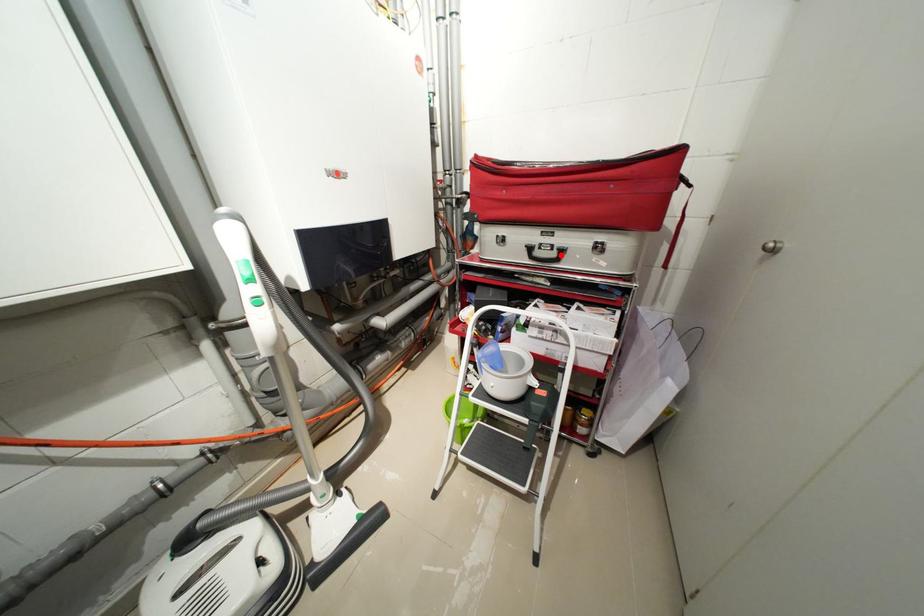
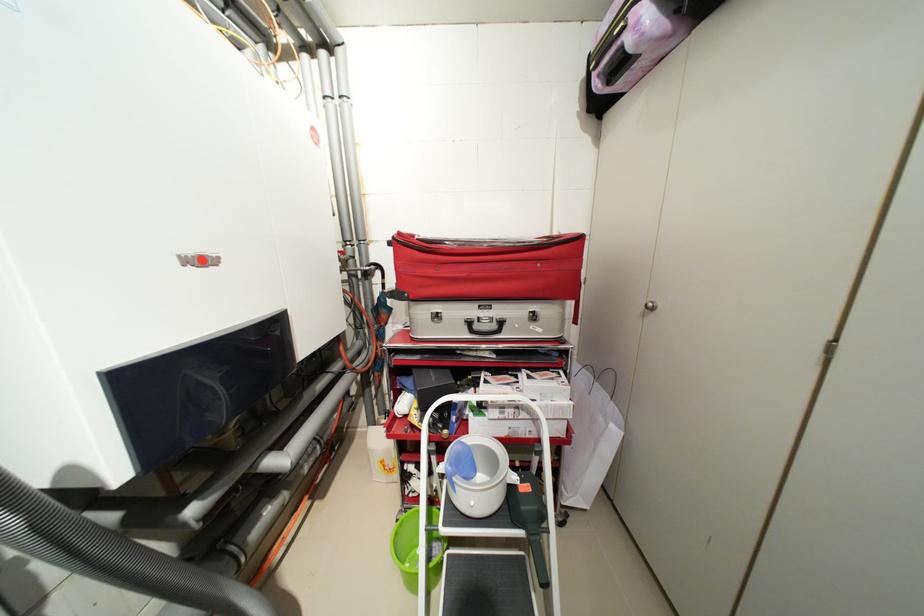
Question: I am providing you with two images of the same scene from different viewpoints. Image1 has a red point marked. In image2, the corresponding 3D location appears at what relative position? Reply with the corresponding letter.

Choices:
 (A) Closer
 (B) Farther

Answer: (B)